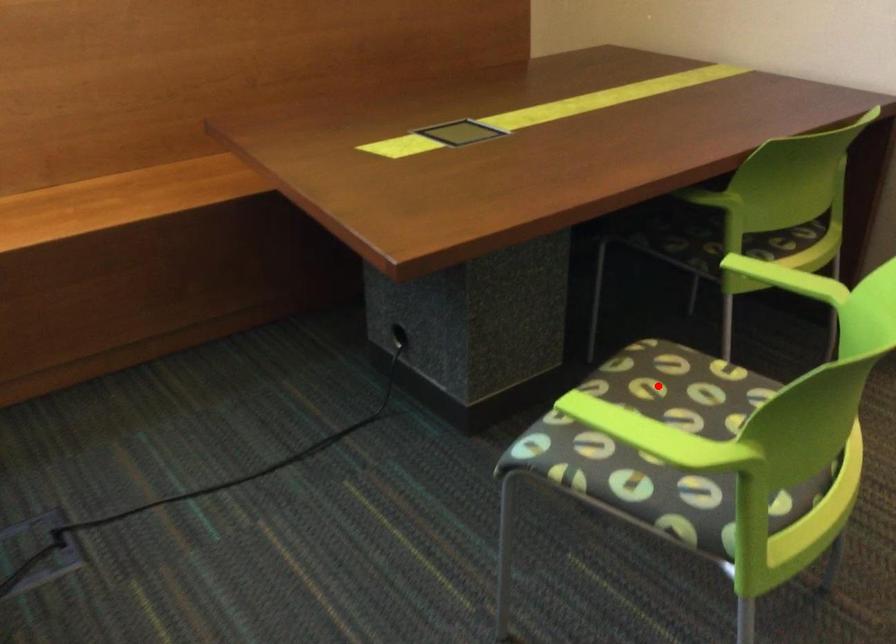
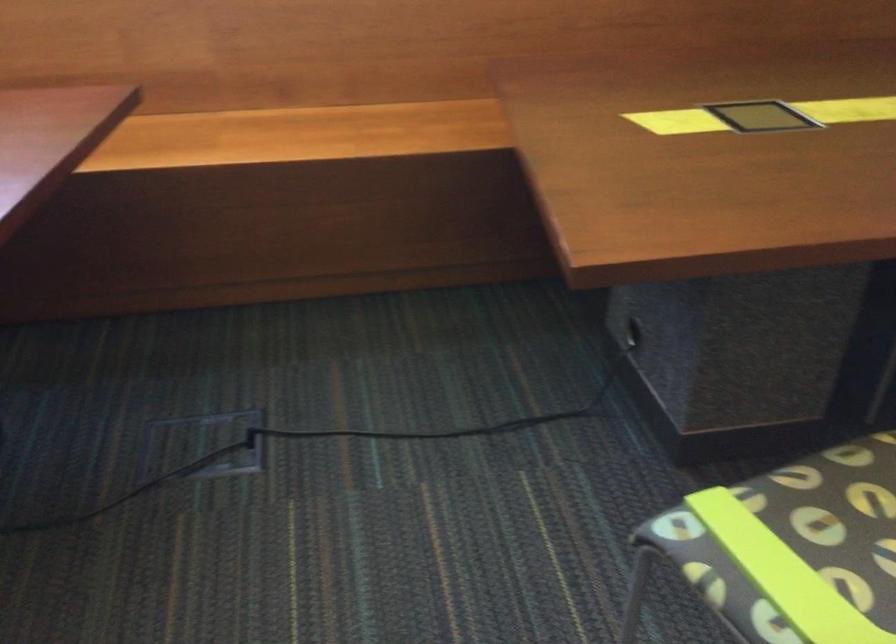
In the second image, find the point that corresponds to the highlighted location in the first image.

(871, 496)